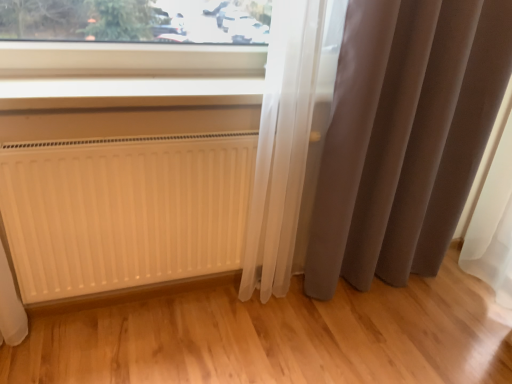
Question: In terms of width, does matte gray curtain at right look wider or thinner when compared to white plastic window sill at upper center?

Choices:
 (A) wide
 (B) thin

Answer: (B)

Question: From the image's perspective, is matte gray curtain at right positioned above or below white plastic window sill at upper center?

Choices:
 (A) below
 (B) above

Answer: (A)

Question: Estimate the real-world distances between objects in this image. Which object is closer to the matte gray curtain at right?

Choices:
 (A) white matte radiator at lower left
 (B) white plastic window sill at upper center

Answer: (A)

Question: Estimate the real-world distances between objects in this image. Which object is closer to the white matte radiator at lower left?

Choices:
 (A) white plastic window sill at upper center
 (B) matte gray curtain at right

Answer: (A)